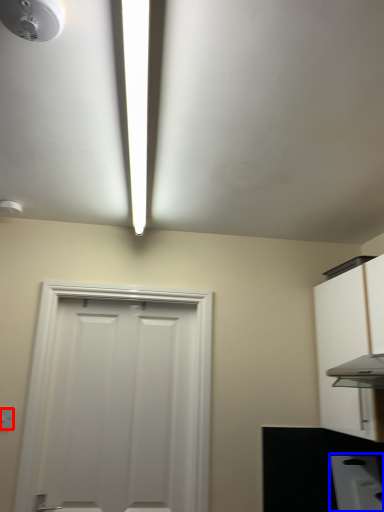
Question: Which point is closer to the camera, light switch (highlighted by a red box) or appliance (highlighted by a blue box)?

Choices:
 (A) light switch
 (B) appliance

Answer: (A)